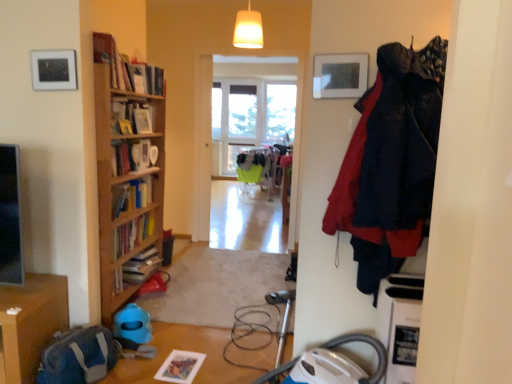
Question: Which direction should I rotate to face transparent glass window at center, the 2th window positioned from the left, — up or down?

Choices:
 (A) up
 (B) down

Answer: (A)

Question: Is matte white picture frame at upper left oriented away from wooden table at lower left?

Choices:
 (A) yes
 (B) no

Answer: (B)

Question: Would you consider matte white picture frame at upper left to be distant from wooden table at lower left?

Choices:
 (A) no
 (B) yes

Answer: (B)

Question: From the image's perspective, is matte white picture frame at upper left over wooden table at lower left?

Choices:
 (A) no
 (B) yes

Answer: (B)

Question: Is matte white picture frame at upper left outside of wooden table at lower left?

Choices:
 (A) no
 (B) yes

Answer: (B)

Question: Does matte white picture frame at upper left have a greater height compared to wooden table at lower left?

Choices:
 (A) no
 (B) yes

Answer: (B)

Question: From a real-world perspective, is matte white picture frame at upper left physically above wooden table at lower left?

Choices:
 (A) yes
 (B) no

Answer: (A)

Question: Does wooden table at lower left have a lesser height compared to dark blue fabric coat at right?

Choices:
 (A) no
 (B) yes

Answer: (B)

Question: Is wooden table at lower left positioned behind dark blue fabric coat at right?

Choices:
 (A) no
 (B) yes

Answer: (B)

Question: From a real-world perspective, is wooden table at lower left on dark blue fabric coat at right?

Choices:
 (A) no
 (B) yes

Answer: (A)

Question: Is wooden table at lower left to the right of dark blue fabric coat at right from the viewer's perspective?

Choices:
 (A) no
 (B) yes

Answer: (A)

Question: Is wooden table at lower left oriented away from dark blue fabric coat at right?

Choices:
 (A) yes
 (B) no

Answer: (B)

Question: Would you say wooden table at lower left is a long distance from dark blue fabric coat at right?

Choices:
 (A) no
 (B) yes

Answer: (B)

Question: Is clear glass window at center, the 1th window from the left, a part of white glossy bookshelf at upper left?

Choices:
 (A) no
 (B) yes

Answer: (A)